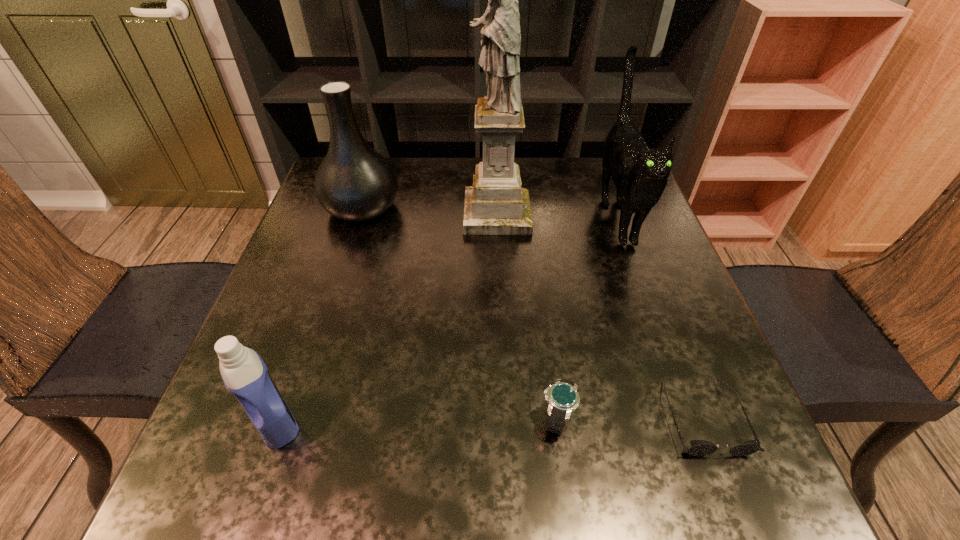
Image resolution: width=960 pixels, height=540 pixels. What are the coordinates of `detergent that is positioned at the left edge` in the screenshot? It's located at (244, 373).

Locate an element on the screen. This screenshot has height=540, width=960. cat located at the right edge is located at coordinates (640, 174).

I want to click on sunglasses present at the right edge, so click(x=698, y=447).

Identify the location of object positioned at the far left corner. (354, 182).

The width and height of the screenshot is (960, 540). What are the coordinates of `object that is at the near left corner` in the screenshot? It's located at (244, 373).

Where is `object that is at the far right corner`? Image resolution: width=960 pixels, height=540 pixels. object that is at the far right corner is located at coordinates coord(640,174).

Where is `object present at the near right corner`? This screenshot has height=540, width=960. object present at the near right corner is located at coordinates (698, 447).

The height and width of the screenshot is (540, 960). In order to click on vacant space at the far edge of the desktop in this screenshot , I will do `click(401, 174)`.

In order to click on vacant area at the left edge of the desktop in this screenshot , I will do `click(316, 228)`.

Identify the location of vacant space at the right edge. (736, 436).